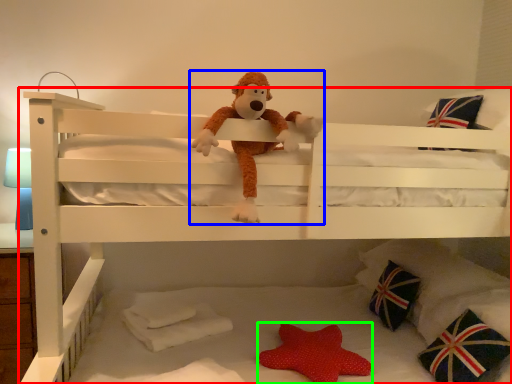
Question: Estimate the real-world distances between objects in this image. Which object is closer to bed (highlighted by a red box), toy (highlighted by a blue box) or toy (highlighted by a green box)?

Choices:
 (A) toy
 (B) toy

Answer: (A)